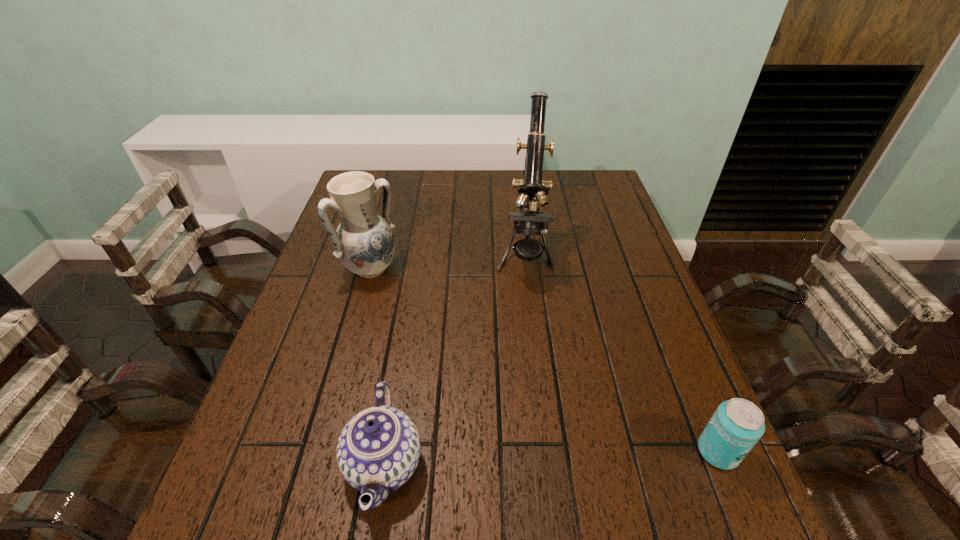
You are a GUI agent. You are given a task and a screenshot of the screen. Output one action in this format:
    pyautogui.click(x=<x>, y=<y>)
    Task: Click on the free space that satisfies the following two spatial constraints: 1. on the front side of the chinaware; 2. at the spout of the second tallest object
    The image size is (960, 540).
    Given the screenshot: What is the action you would take?
    316,464

What are the coordinates of `free region that satisfies the following two spatial constraints: 1. on the front side of the beer can; 2. on the left side of the second object from right to left` in the screenshot? It's located at coord(547,451).